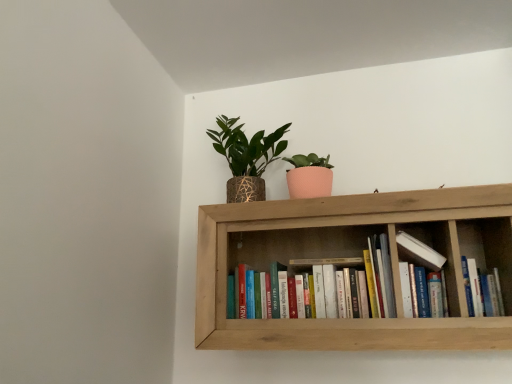
Question: Is textured gold pot at upper center wider than hardcover books at center, the second book from the right?

Choices:
 (A) no
 (B) yes

Answer: (B)

Question: Is hardcover books at center, the second book from the right, completely or partially inside textured gold pot at upper center?

Choices:
 (A) no
 (B) yes

Answer: (A)

Question: Does textured gold pot at upper center have a smaller size compared to hardcover books at center, which appears as the 1th book when viewed from the left?

Choices:
 (A) no
 (B) yes

Answer: (A)

Question: Is textured gold pot at upper center at the right side of hardcover books at center, which appears as the 1th book when viewed from the left?

Choices:
 (A) no
 (B) yes

Answer: (A)

Question: Considering the relative positions of textured gold pot at upper center and hardcover books at center, which appears as the 1th book when viewed from the left, in the image provided, is textured gold pot at upper center to the left of hardcover books at center, which appears as the 1th book when viewed from the left, from the viewer's perspective?

Choices:
 (A) no
 (B) yes

Answer: (B)

Question: From a real-world perspective, is textured gold pot at upper center located higher than hardcover books at center, the second book from the right?

Choices:
 (A) no
 (B) yes

Answer: (B)

Question: Can textured gold pot at upper center be found inside hardcover book at center, positioned as the 2th book in left-to-right order?

Choices:
 (A) no
 (B) yes

Answer: (A)

Question: From a real-world perspective, is hardcover book at center, positioned as the 2th book in left-to-right order, on textured gold pot at upper center?

Choices:
 (A) no
 (B) yes

Answer: (A)

Question: Considering the relative sizes of hardcover book at center, positioned as the 2th book in left-to-right order, and textured gold pot at upper center in the image provided, is hardcover book at center, positioned as the 2th book in left-to-right order, shorter than textured gold pot at upper center?

Choices:
 (A) yes
 (B) no

Answer: (A)

Question: From a real-world perspective, is hardcover book at center, which is the 1th book in right-to-left order, beneath textured gold pot at upper center?

Choices:
 (A) no
 (B) yes

Answer: (B)

Question: Considering the relative positions of hardcover book at center, which is the 1th book in right-to-left order, and textured gold pot at upper center in the image provided, is hardcover book at center, which is the 1th book in right-to-left order, to the right of textured gold pot at upper center from the viewer's perspective?

Choices:
 (A) yes
 (B) no

Answer: (A)

Question: Is hardcover book at center, which is the 1th book in right-to-left order, turned away from textured gold pot at upper center?

Choices:
 (A) no
 (B) yes

Answer: (A)

Question: Is hardcover books at center, the second book from the right, positioned far away from hardcover book at center, which is the 1th book in right-to-left order?

Choices:
 (A) no
 (B) yes

Answer: (A)